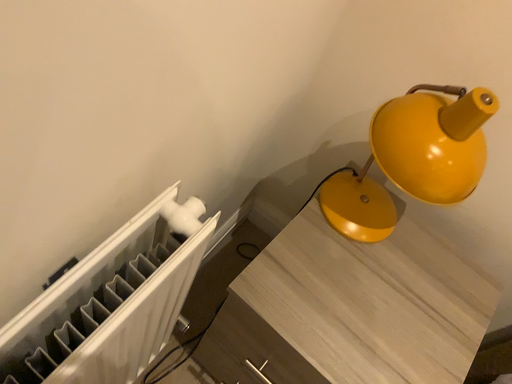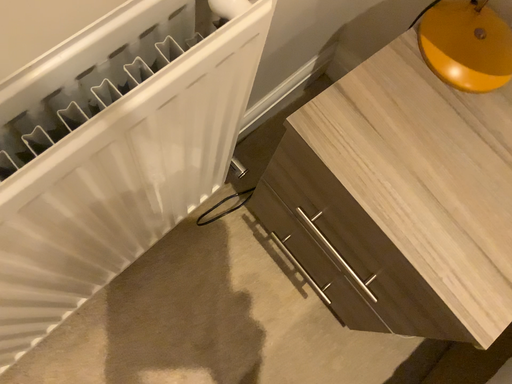
Question: How did the camera likely rotate when shooting the video?

Choices:
 (A) rotated downward
 (B) rotated upward

Answer: (A)